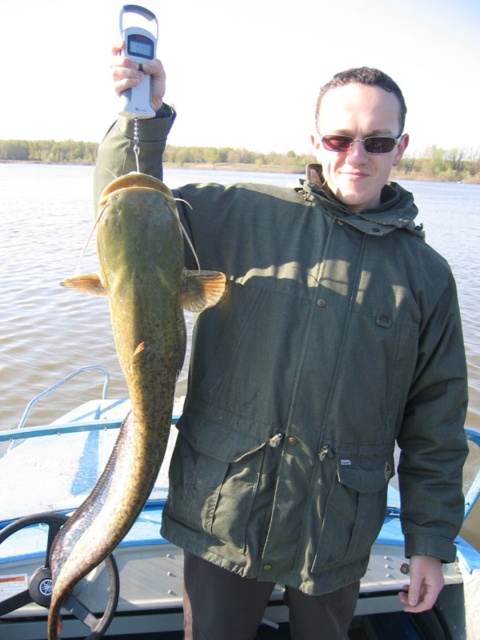
Is green scaly fish at left closer to camera compared to sunglasses at center?

Yes, green scaly fish at left is in front of sunglasses at center.

Who is lower down, green scaly fish at left or sunglasses at center?

green scaly fish at left is below.

Which is in front, point (98, 552) or point (333, 150)?

Point (98, 552) is more forward.

Where is `green scaly fish at left`? Image resolution: width=480 pixels, height=640 pixels. green scaly fish at left is located at coordinates (132, 364).

Where is `green matte jacket at center`? The height and width of the screenshot is (640, 480). green matte jacket at center is located at coordinates (316, 387).

Does green matte jacket at center have a lesser width compared to sunglasses at center?

No, green matte jacket at center is not thinner than sunglasses at center.

In order to click on green matte jacket at center in this screenshot , I will do `click(316, 387)`.

The image size is (480, 640). Find the location of `green matte jacket at center`. green matte jacket at center is located at coordinates (316, 387).

What do you see at coordinates (47, 497) in the screenshot? This screenshot has width=480, height=640. I see `blue plastic boat at center` at bounding box center [47, 497].

Can you confirm if blue plastic boat at center is positioned to the left of green scaly fish at left?

Correct, you'll find blue plastic boat at center to the left of green scaly fish at left.

Between point (428, 625) and point (85, 552), which one is positioned behind?

The point (428, 625) is behind.

Identify the location of blue plastic boat at center. (47, 497).